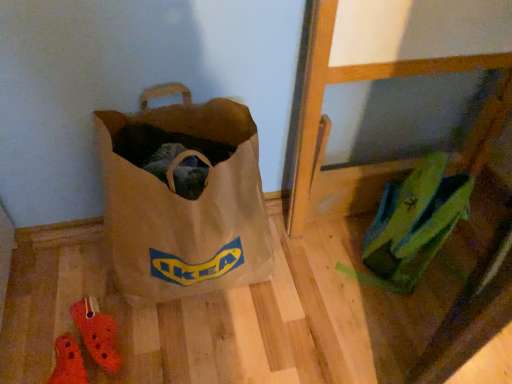
At what (x,y) coordinates should I click in order to perform the action: click on unoccupied region to the right of orange croc at lower left, the second footwear positioned from the bottom. Please return your answer as a coordinate pair (x, y). Looking at the image, I should click on (170, 337).